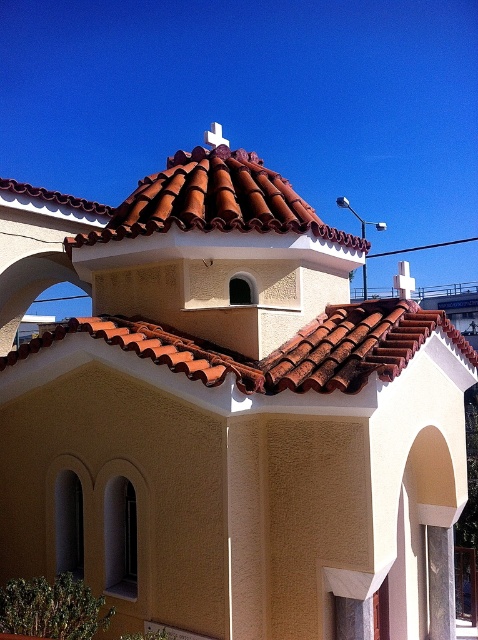
You are standing in front of the Mediterranean style building and want to determine which of the two points, point (313,333) or point (136,196), is closer to you. Based on the building structure, which point is nearer?

Point (313,333) is closer to the viewer than point (136,196).

You are an architect designing a model of the building. You need to place a small decorative cross exactly at the center of the brown clay tiles at center. Where should you place the cross in terms of coordinates?

The brown clay tiles at center are located at coordinates point (279, 348), so the cross should be placed at those coordinates to be exactly at the center.

You are standing in front of a Mediterranean style building and notice two features on the roof area. You see the brown clay tiles at center and the brown tile roof at upper center. Which of these is located lower on the roof structure?

The brown clay tiles at center is positioned under brown tile roof at upper center, so it is located lower on the roof structure.